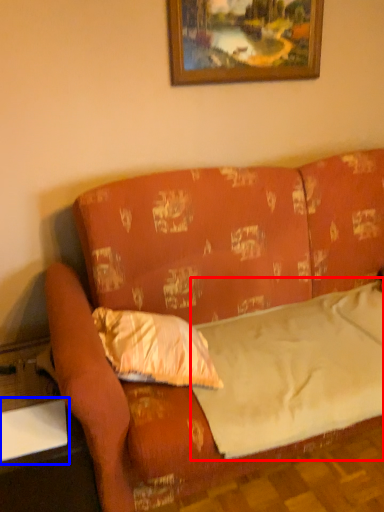
Question: Which object appears farthest to the camera in this image, sheet (highlighted by a red box) or table (highlighted by a blue box)?

Choices:
 (A) sheet
 (B) table

Answer: (B)